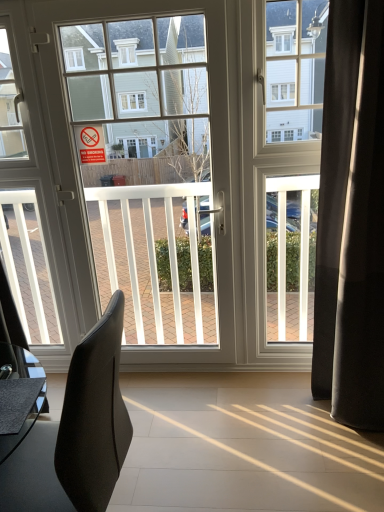
Question: Is white glossy door at center at the left side of black leather chair at left?

Choices:
 (A) no
 (B) yes

Answer: (A)

Question: Considering the relative sizes of white glossy door at center and black leather chair at left in the image provided, is white glossy door at center thinner than black leather chair at left?

Choices:
 (A) no
 (B) yes

Answer: (B)

Question: Could black leather chair at left be considered to be inside white glossy door at center?

Choices:
 (A) yes
 (B) no

Answer: (B)

Question: Is white glossy door at center positioned far away from black leather chair at left?

Choices:
 (A) yes
 (B) no

Answer: (A)

Question: Can you confirm if white glossy door at center is taller than black leather chair at left?

Choices:
 (A) no
 (B) yes

Answer: (B)

Question: Relative to black fabric curtain at right, is black leather chair at left in front or behind?

Choices:
 (A) front
 (B) behind

Answer: (A)

Question: Visually, is black leather chair at left positioned to the left or to the right of black fabric curtain at right?

Choices:
 (A) left
 (B) right

Answer: (A)

Question: Is point (4, 488) closer or farther from the camera than point (375, 18)?

Choices:
 (A) closer
 (B) farther

Answer: (A)

Question: From a real-world perspective, relative to black fabric curtain at right, is black leather chair at left vertically above or below?

Choices:
 (A) above
 (B) below

Answer: (B)

Question: Considering the positions of white glossy door at center and red paper sign at upper left in the image, is white glossy door at center bigger or smaller than red paper sign at upper left?

Choices:
 (A) big
 (B) small

Answer: (A)

Question: Considering the relative positions of white glossy door at center and red paper sign at upper left in the image provided, is white glossy door at center to the left or to the right of red paper sign at upper left?

Choices:
 (A) right
 (B) left

Answer: (A)

Question: Is white glossy door at center spatially inside red paper sign at upper left, or outside of it?

Choices:
 (A) outside
 (B) inside

Answer: (A)

Question: From the image's perspective, is white glossy door at center above or below red paper sign at upper left?

Choices:
 (A) below
 (B) above

Answer: (A)

Question: Is red paper sign at upper left taller or shorter than black leather chair at left?

Choices:
 (A) tall
 (B) short

Answer: (B)

Question: Looking at the image, does red paper sign at upper left seem bigger or smaller compared to black leather chair at left?

Choices:
 (A) big
 (B) small

Answer: (B)